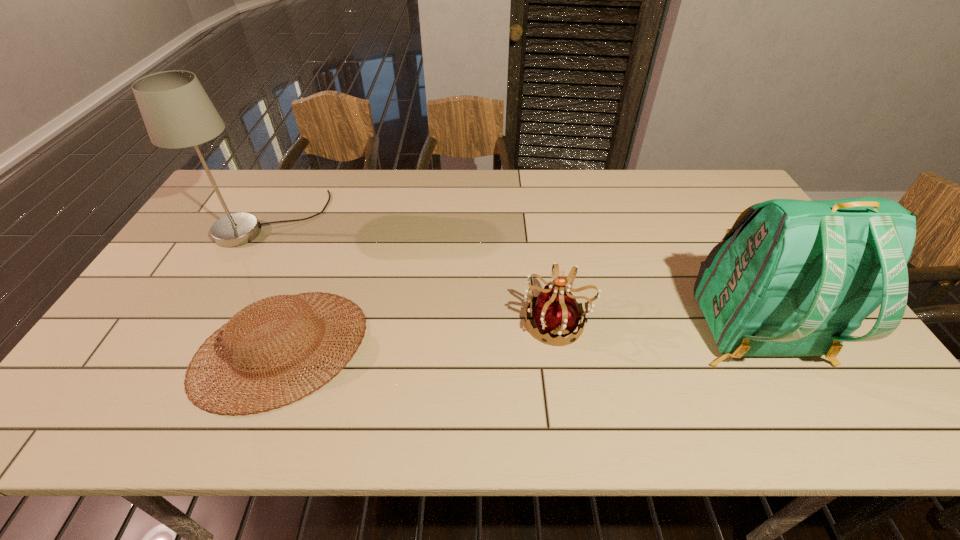
Locate an element on the screen. This screenshot has width=960, height=540. object that is at the far edge is located at coordinates (177, 112).

At what (x,y) coordinates should I click in order to perform the action: click on object that is positioned at the near edge. Please return your answer as a coordinate pair (x, y). Looking at the image, I should click on (240, 325).

The image size is (960, 540). Identify the location of object that is at the left edge. (177, 112).

Where is `object present at the right edge`? The image size is (960, 540). object present at the right edge is located at coordinates (791, 277).

Locate an element on the screen. object at the far left corner is located at coordinates (177, 112).

The height and width of the screenshot is (540, 960). Find the location of `blank space at the far edge of the desktop`. blank space at the far edge of the desktop is located at coordinates (460, 201).

Locate an element on the screen. The width and height of the screenshot is (960, 540). vacant space at the near edge of the desktop is located at coordinates (529, 396).

Find the location of `free spot at the left edge of the desktop`. free spot at the left edge of the desktop is located at coordinates pyautogui.click(x=181, y=271).

In the image, there is a desktop. Identify the location of free region at the far right corner. (698, 198).

Where is `vacant space at the near right corner`? Image resolution: width=960 pixels, height=540 pixels. vacant space at the near right corner is located at coordinates (847, 419).